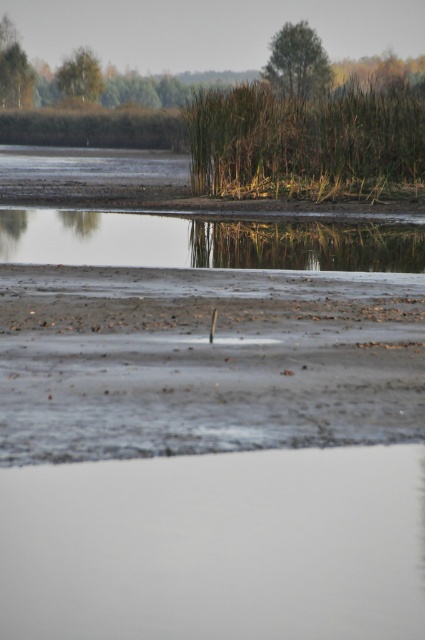
Question: Which object appears farthest from the camera in this image?

Choices:
 (A) brown grass at upper center
 (B) gray sandy beach at center
 (C) smooth reflective water at center

Answer: (A)

Question: Can you confirm if brown grass at upper center is bigger than smooth reflective water at center?

Choices:
 (A) no
 (B) yes

Answer: (B)

Question: Which point is closer to the camera?

Choices:
 (A) (374, 141)
 (B) (127, 237)
 (C) (305, 368)

Answer: (C)

Question: Which of these objects is positioned closest to the brown grass at upper center?

Choices:
 (A) gray sandy beach at center
 (B) smooth reflective water at center

Answer: (B)

Question: Is gray sandy beach at center bigger than brown grass at upper center?

Choices:
 (A) no
 (B) yes

Answer: (A)

Question: Observing the image, what is the correct spatial positioning of gray sandy beach at center in reference to smooth reflective water at center?

Choices:
 (A) right
 (B) left

Answer: (A)